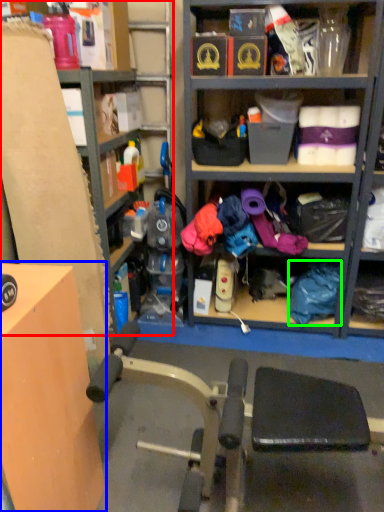
Question: Which object is positioned closest to shelf (highlighted by a red box)? Select from table (highlighted by a blue box) and clothing (highlighted by a green box).

Choices:
 (A) table
 (B) clothing

Answer: (A)